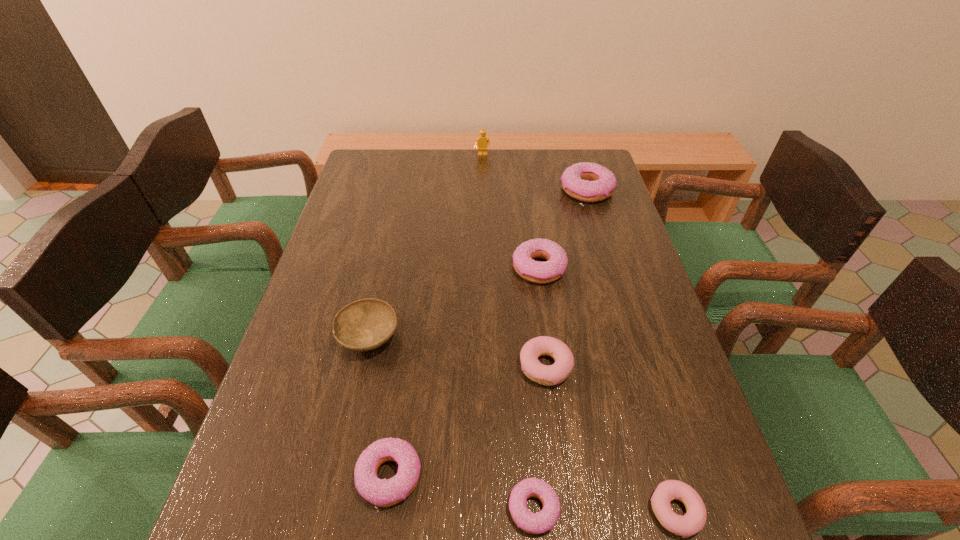
Locate an element on the screen. free location that satisfies the following two spatial constraints: 1. on the back side of the farthest doughnut; 2. on the right side of the smallest purple doughnut is located at coordinates (508, 191).

Where is `free location that satisfies the following two spatial constraints: 1. on the back side of the right pink doughnut; 2. on the left side of the tallest doughnut`? Image resolution: width=960 pixels, height=540 pixels. free location that satisfies the following two spatial constraints: 1. on the back side of the right pink doughnut; 2. on the left side of the tallest doughnut is located at coordinates (583, 191).

What are the coordinates of `free location that satisfies the following two spatial constraints: 1. on the face of the fifth shortest doughnut; 2. on the right side of the tallest object` in the screenshot? It's located at (484, 268).